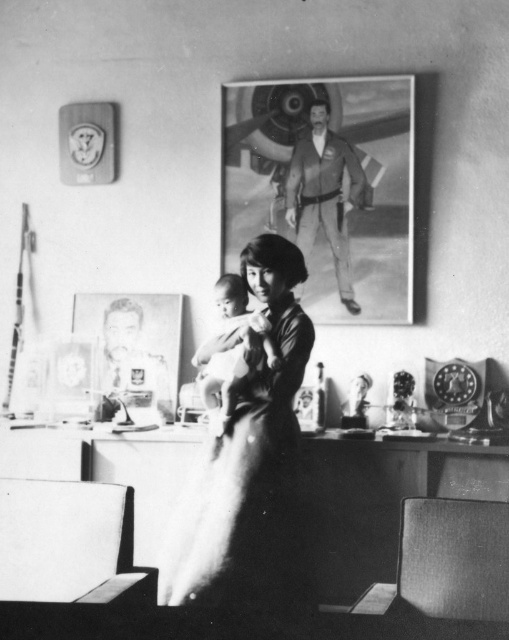
You are a tailor who needs to measure the space between the smooth leather jacket at upper center and the smooth skin baby at center for a custom display. Can you fit a 24 inch wide decorative shelf between them?

The distance between the smooth leather jacket at upper center and the smooth skin baby at center is 26.42 inches, so a 24 inch wide decorative shelf can fit between them since it is narrower than the available space.

What are the coordinates of the smooth paper portrait at upper center?

The smooth paper portrait at upper center is located at point (326, 188).